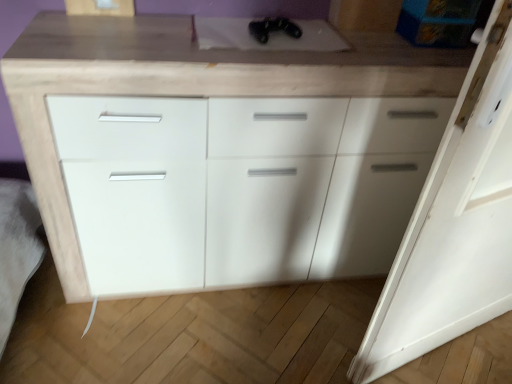
Question: Considering the positions of black matte controller at upper center and white matte cabinet at center in the image, is black matte controller at upper center wider or thinner than white matte cabinet at center?

Choices:
 (A) wide
 (B) thin

Answer: (B)

Question: Is black matte controller at upper center inside or outside of white matte cabinet at center?

Choices:
 (A) inside
 (B) outside

Answer: (A)

Question: Which of these objects is positioned closest to the white matte cabinet at center?

Choices:
 (A) black matte controller at upper center
 (B) white matte door at right

Answer: (A)

Question: Considering the real-world distances, which object is farthest from the black matte controller at upper center?

Choices:
 (A) white matte door at right
 (B) white matte cabinet at center

Answer: (A)